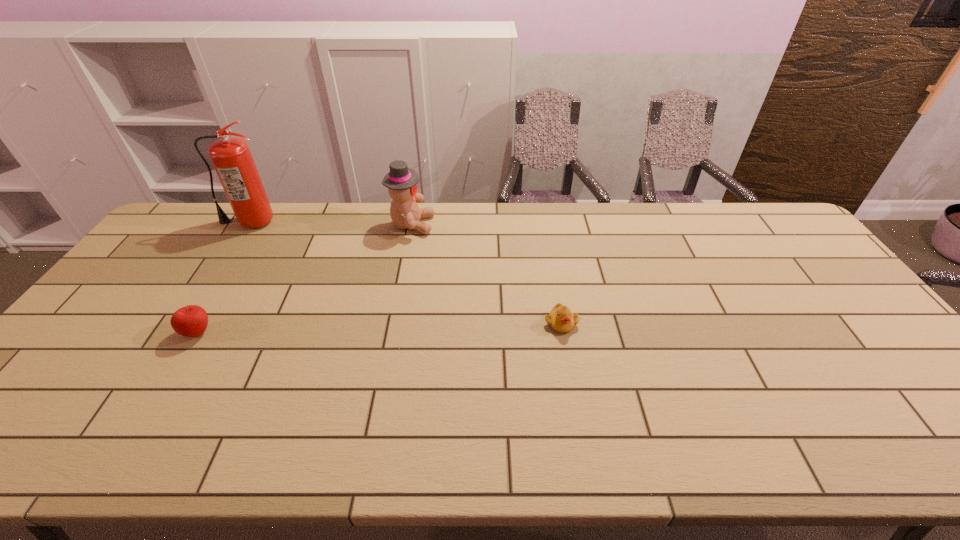
You are a GUI agent. You are given a task and a screenshot of the screen. Output one action in this format:
    pyautogui.click(x=<x>, y=<y>)
    Task: Click on the fire extinguisher located at the far edge
    
    Given the screenshot: What is the action you would take?
    pyautogui.click(x=231, y=157)

Find the location of a particular element. Image resolution: width=960 pixels, height=540 pixels. rag_doll that is at the far edge is located at coordinates (401, 181).

Locate an element on the screen. This screenshot has width=960, height=540. object located in the left edge section of the desktop is located at coordinates (231, 157).

The height and width of the screenshot is (540, 960). Find the location of `object that is at the far left corner`. object that is at the far left corner is located at coordinates click(x=231, y=157).

Image resolution: width=960 pixels, height=540 pixels. What are the coordinates of `free region at the far edge of the desktop` in the screenshot? It's located at (636, 214).

This screenshot has height=540, width=960. I want to click on vacant space at the near edge of the desktop, so click(x=227, y=439).

Where is `vacant space at the left edge of the desktop`? The width and height of the screenshot is (960, 540). vacant space at the left edge of the desktop is located at coordinates (153, 259).

Where is `vacant region at the right edge of the desktop`? Image resolution: width=960 pixels, height=540 pixels. vacant region at the right edge of the desktop is located at coordinates (775, 274).

Where is `vacant area that lies between the apple and the rag_doll`? Image resolution: width=960 pixels, height=540 pixels. vacant area that lies between the apple and the rag_doll is located at coordinates (305, 278).

This screenshot has height=540, width=960. Find the location of `empty space that is in between the apple and the tallest object`. empty space that is in between the apple and the tallest object is located at coordinates (224, 277).